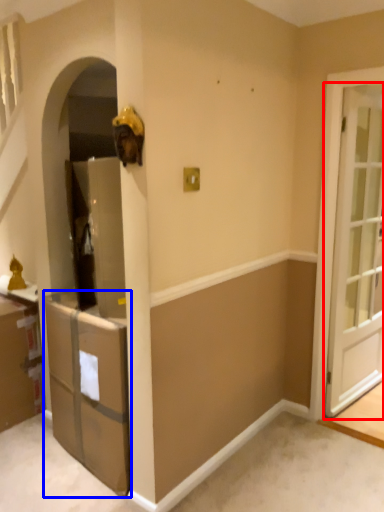
Question: Which object is further to the camera taking this photo, door (highlighted by a red box) or cabinetry (highlighted by a blue box)?

Choices:
 (A) door
 (B) cabinetry

Answer: (A)